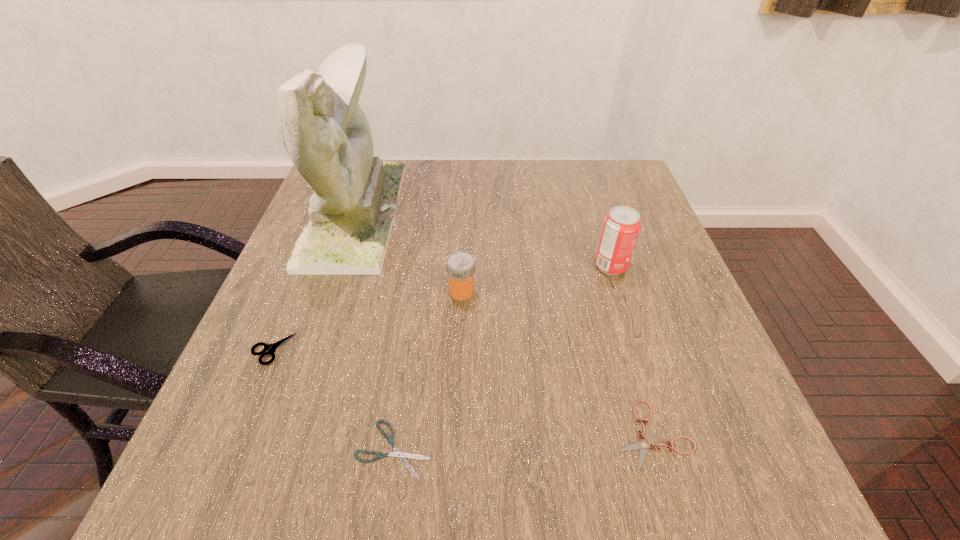
The width and height of the screenshot is (960, 540). I want to click on object at the near right corner, so click(642, 444).

This screenshot has height=540, width=960. In the image, there is a desktop. In order to click on vacant space at the far edge in this screenshot , I will do `click(413, 198)`.

Image resolution: width=960 pixels, height=540 pixels. In order to click on vacant space at the near edge of the desktop in this screenshot , I will do `click(319, 480)`.

The height and width of the screenshot is (540, 960). In the image, there is a desktop. Find the location of `vacant space at the left edge`. vacant space at the left edge is located at coordinates (330, 278).

In the image, there is a desktop. At what (x,y) coordinates should I click in order to perform the action: click on vacant space at the right edge. Please return your answer as a coordinate pair (x, y). This screenshot has width=960, height=540. Looking at the image, I should click on (683, 281).

This screenshot has width=960, height=540. I want to click on free region at the far right corner of the desktop, so click(625, 166).

Identify the location of vacant region at the near right corner of the desktop. (673, 465).

Where is `free space that is in between the fourth object from right to left and the soda can`? free space that is in between the fourth object from right to left and the soda can is located at coordinates (502, 357).

Find the location of `free space that is in between the third farthest object and the soda can`. free space that is in between the third farthest object and the soda can is located at coordinates coord(537,279).

Where is `vacant space in between the third object from left to right and the leftmost shears`? This screenshot has height=540, width=960. vacant space in between the third object from left to right and the leftmost shears is located at coordinates (333, 399).